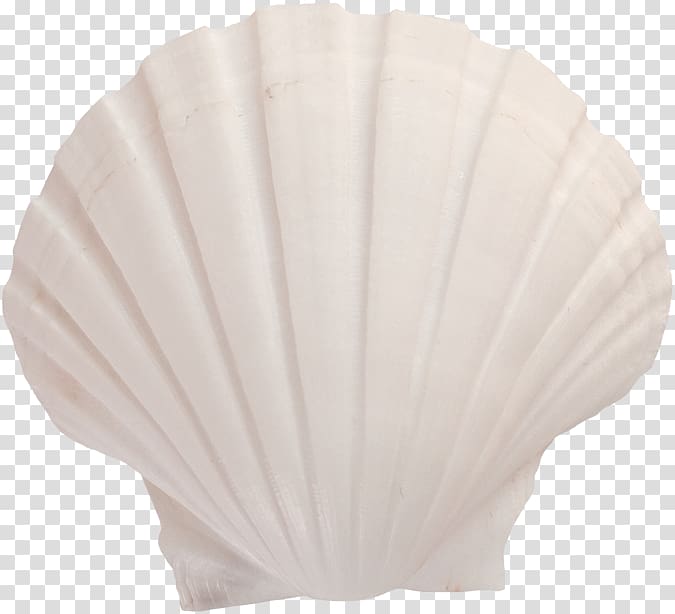
Where is `upper right tile background`? The height and width of the screenshot is (614, 675). upper right tile background is located at coordinates (626, 53).